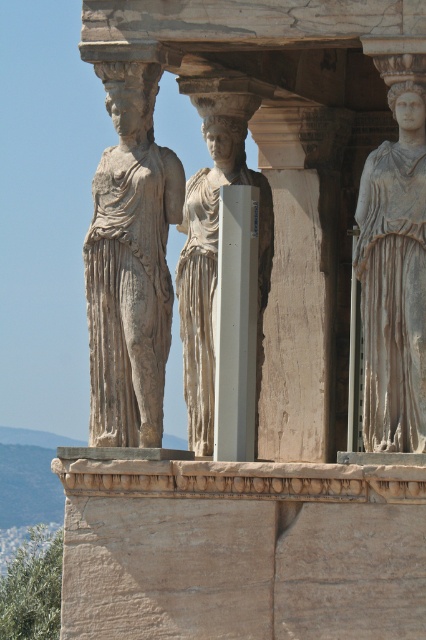
You are an architect examining the Caryatid Porch of the Erechtheion. You notice the white marble statue at center and the white smooth pillar at center. Which one has a greater width?

The white marble statue at center has a greater width than the white smooth pillar at center.

You are standing at a point 197.43 feet away from the Caryatid Porch of the Erechtheion temple. If you want to get a closer look at the Caryatid Porch, should you move towards or away from the point labeled as point (126, 168)?

You should move towards the point labeled as point (126, 168) because you are currently 197.43 feet away from it, and moving closer would bring you nearer to the Caryatid Porch.

You are an architect examining the Erechtheion temple. You notice the white marble statue at center and the white smooth pillar at center. Which one is bigger in size?

The white marble statue at center is larger in size compared to the white smooth pillar at center.